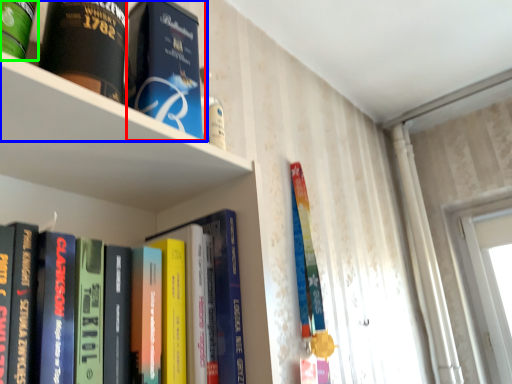
Question: Estimate the real-world distances between objects in this image. Which object is closer to book (highlighted by a red box), book (highlighted by a blue box) or book (highlighted by a green box)?

Choices:
 (A) book
 (B) book

Answer: (A)